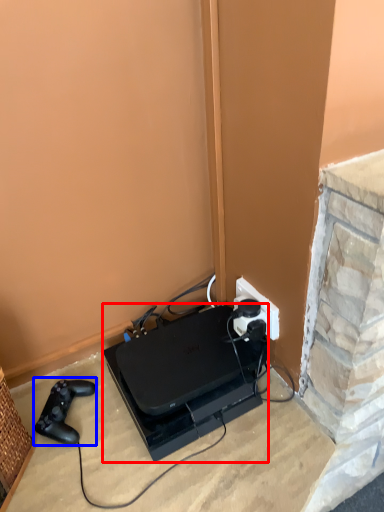
Question: Which of the following is the farthest to the observer, appliance (highlighted by a red box) or game controller (highlighted by a blue box)?

Choices:
 (A) appliance
 (B) game controller

Answer: (B)